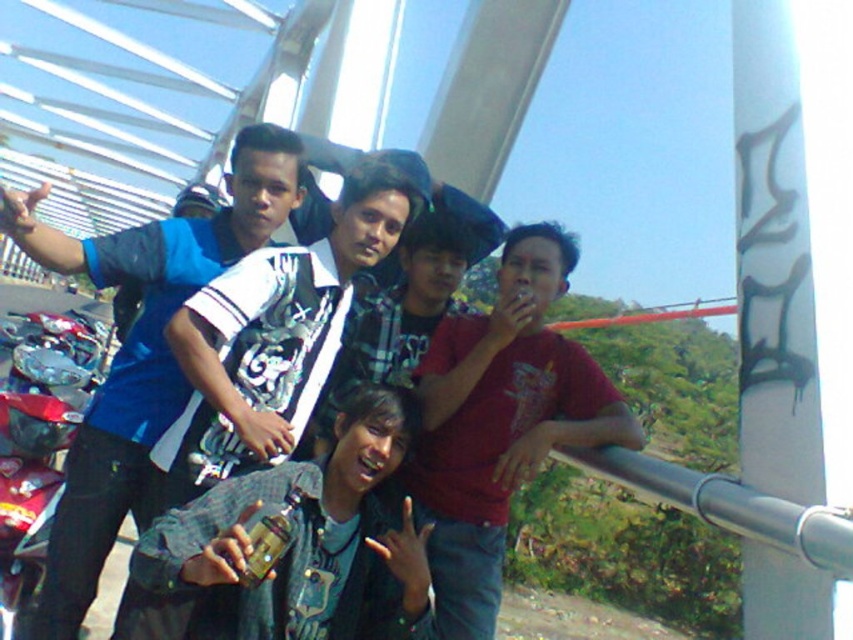
Question: Is matte red shirt at center positioned in front of blue fabric shirt at left?

Choices:
 (A) no
 (B) yes

Answer: (A)

Question: Does denim jacket at center come behind white glossy shirt at center?

Choices:
 (A) yes
 (B) no

Answer: (B)

Question: Estimate the real-world distances between objects in this image. Which object is farther from the matte red shirt at center?

Choices:
 (A) white glossy shirt at center
 (B) blue fabric shirt at left

Answer: (B)

Question: Which point is farther from the camera taking this photo?

Choices:
 (A) click(64, 557)
 (B) click(183, 618)
 (C) click(334, 262)

Answer: (C)

Question: Which point is farther from the camera taking this photo?

Choices:
 (A) (194, 440)
 (B) (561, 344)
 (C) (402, 408)

Answer: (B)

Question: Is matte red shirt at center wider than blue fabric shirt at left?

Choices:
 (A) no
 (B) yes

Answer: (A)